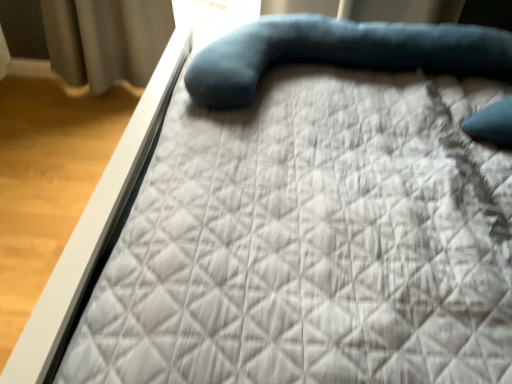
Describe the element at coordinates (341, 53) in the screenshot. I see `teal plush pillow at center` at that location.

The height and width of the screenshot is (384, 512). Identify the location of teal plush pillow at center. (341, 53).

You are a GUI agent. You are given a task and a screenshot of the screen. Output one action in this format:
    pyautogui.click(x=<x>, y=<y>)
    Task: Click on the teal plush pillow at center
    
    Given the screenshot: What is the action you would take?
    pyautogui.click(x=341, y=53)